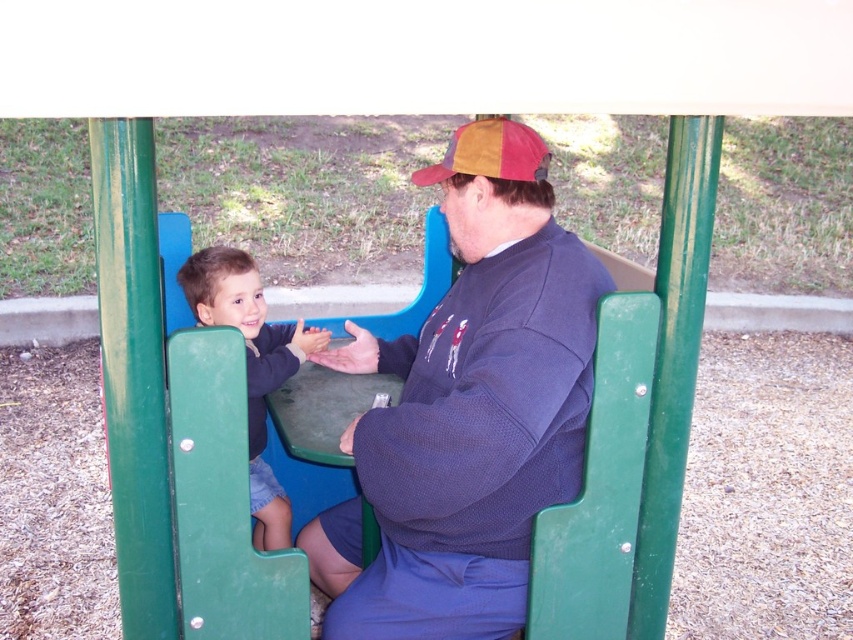
Consider the image. You are a photographer trying to capture the perfect shot of the dark blue sweater at center. If you want to focus your camera on the exact center of the sweater, what coordinates should you aim for?

The dark blue sweater at center is located at coordinates point [467,410], so you should aim for those coordinates to focus on the exact center of the sweater.

You are a photographer trying to capture a candid shot of the dark blue sweater at center and the matte blue shirt at left. Since you want to ensure both subjects are in focus, you need to know their heights. Which one is taller?

The dark blue sweater at center is taller than the matte blue shirt at left.

You are a fashion designer observing the playground scene. You need to determine which item is bigger between the matte blue shirt at left and the multicolored fabric baseball cap at upper center. Which one is larger?

The matte blue shirt at left is larger than the multicolored fabric baseball cap at upper center according to the description.